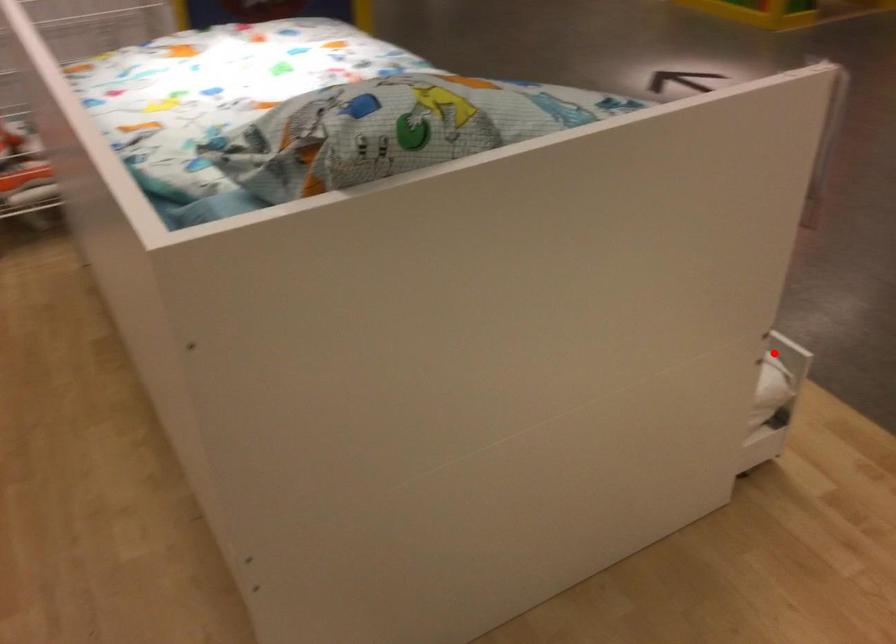
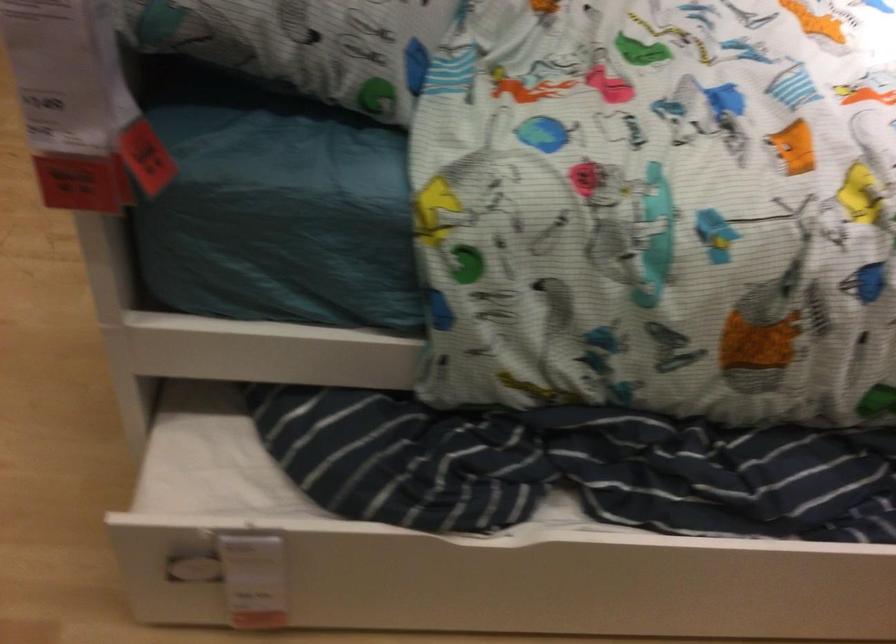
Find the pixel in the second image that matches the highlighted location in the first image.

(240, 574)